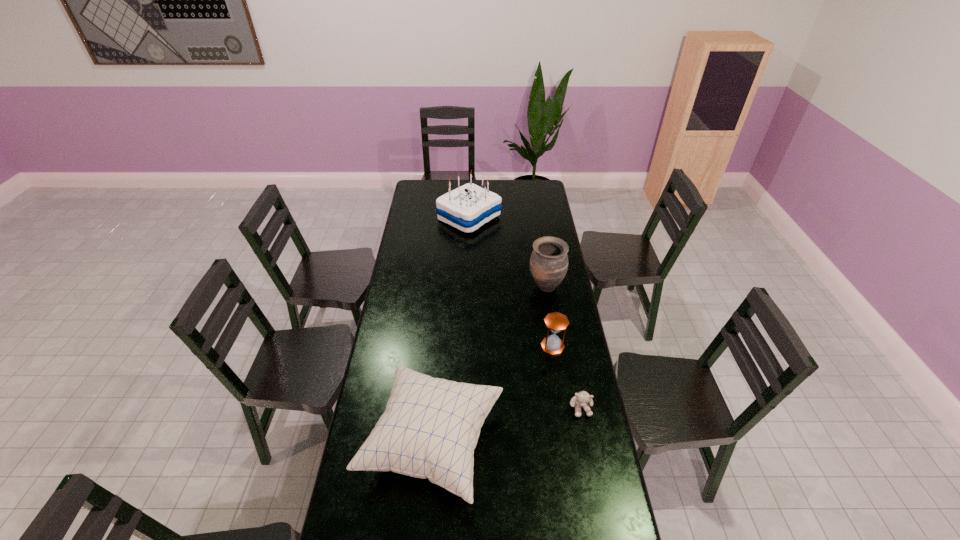
The image size is (960, 540). Identify the location of birthday cake. (468, 207).

This screenshot has width=960, height=540. Find the location of `the second farthest object`. the second farthest object is located at coordinates (549, 260).

Identify the location of cushion. (430, 427).

At what (x,y) coordinates should I click in order to perform the action: click on hourglass. Please return your answer as a coordinate pair (x, y). The image size is (960, 540). Looking at the image, I should click on (556, 322).

The height and width of the screenshot is (540, 960). In order to click on the third nearest object in this screenshot , I will do `click(556, 322)`.

This screenshot has height=540, width=960. Find the location of `the shortest object`. the shortest object is located at coordinates (581, 399).

The width and height of the screenshot is (960, 540). I want to click on vacant space located 0.050m on the back of the birthday cake, so click(x=470, y=195).

You are a GUI agent. You are given a task and a screenshot of the screen. Output one action in this format:
    pyautogui.click(x=<x>, y=<y>)
    Task: Click on the vacant space located on the front of the urn
    
    Given the screenshot: What is the action you would take?
    pyautogui.click(x=557, y=355)

Where is `vacant space located 0.170m on the right of the cushion`? This screenshot has height=540, width=960. vacant space located 0.170m on the right of the cushion is located at coordinates (553, 443).

Find the location of `blank space located 0.330m on the left of the third farthest object`. blank space located 0.330m on the left of the third farthest object is located at coordinates (462, 346).